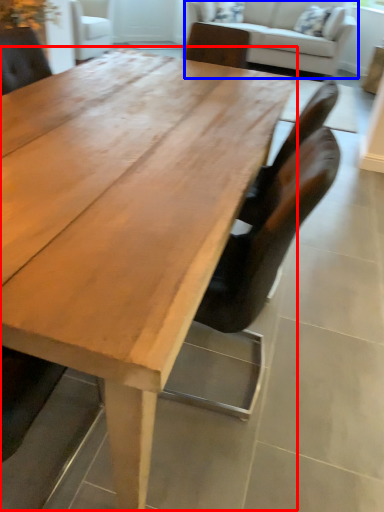
Question: Which point is closer to the camera, coffee table (highlighted by a red box) or studio couch (highlighted by a blue box)?

Choices:
 (A) coffee table
 (B) studio couch

Answer: (A)